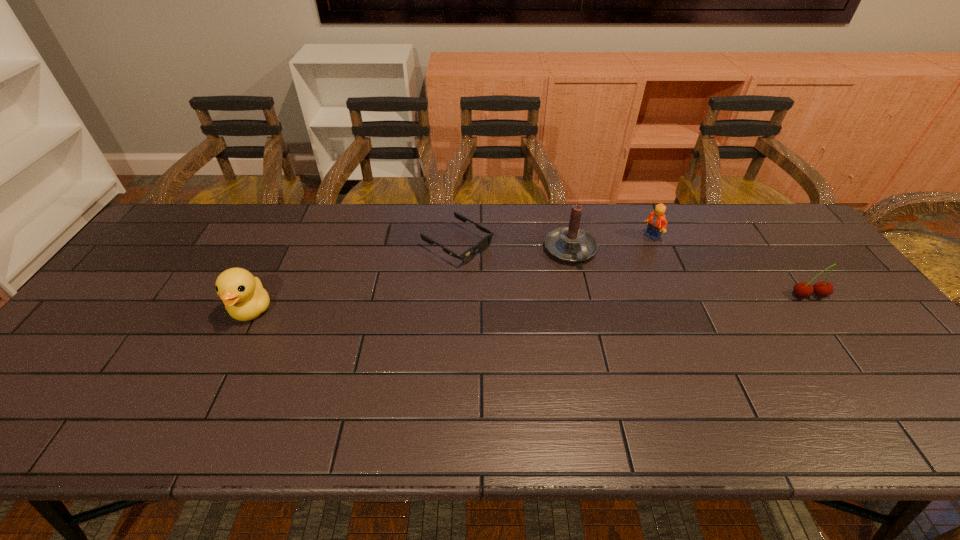
The height and width of the screenshot is (540, 960). Identify the location of vacant space on the desktop that is between the leftmost object and the cherry and is positioned on the temples of the sunglasses. (557, 302).

I want to click on vacant space on the desktop that is between the leftmost object and the rightmost object and is positioned on the front-facing side of the fourth object from left to right, so click(612, 301).

I want to click on vacant space on the desktop that is between the duck and the cherry and is positioned on the side of the third object from right to left with the handle loop, so click(598, 301).